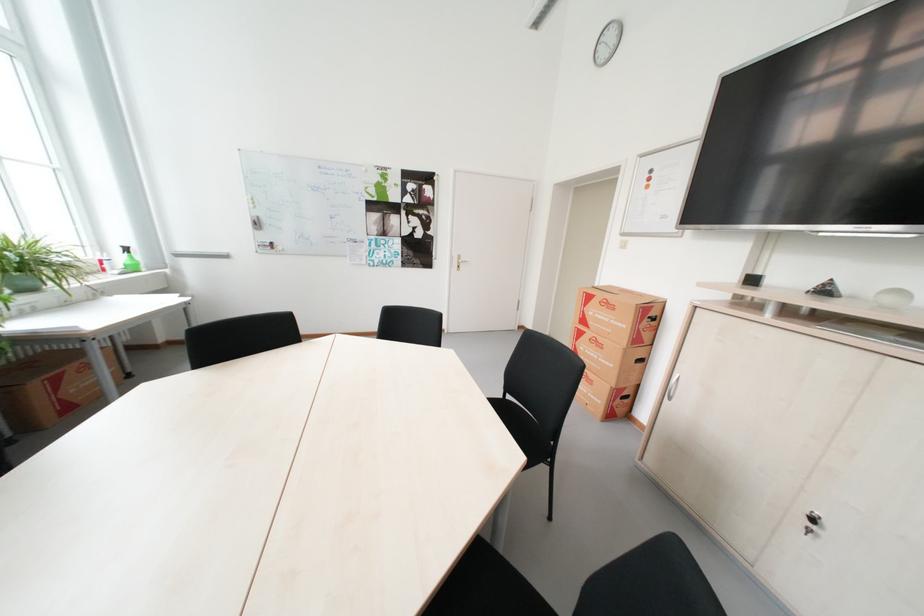
Image resolution: width=924 pixels, height=616 pixels. What do you see at coordinates (129, 260) in the screenshot? I see `the spray bottle trigger` at bounding box center [129, 260].